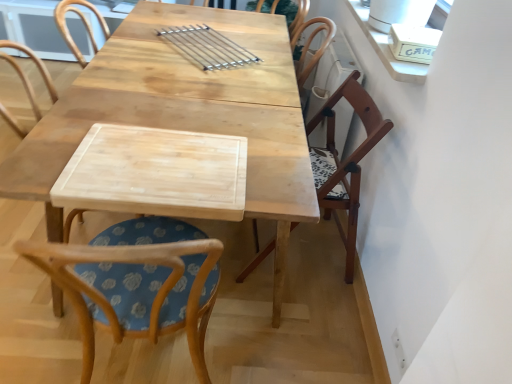
This screenshot has height=384, width=512. Identify the location of vacant space in wooden chair at right, which appears as the 1th chair when viewed from the right (from a real-world perspective). (311, 248).